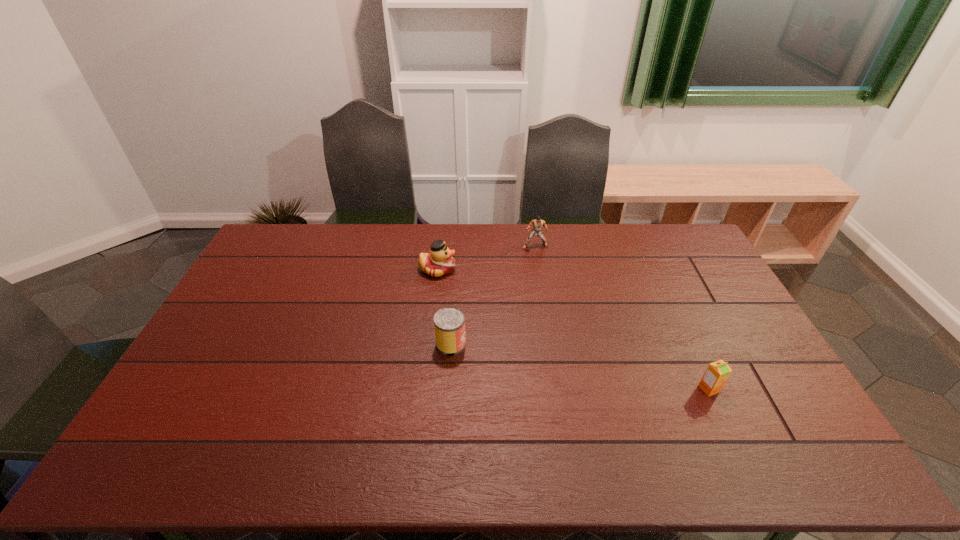
Image resolution: width=960 pixels, height=540 pixels. I want to click on puncher, so click(537, 224).

This screenshot has width=960, height=540. I want to click on the second object from right to left, so click(537, 224).

The image size is (960, 540). What are the coordinates of `the third nearest object` in the screenshot? It's located at (439, 262).

Where is `can`? This screenshot has width=960, height=540. can is located at coordinates (449, 322).

Identify the location of orange juice. The width and height of the screenshot is (960, 540). (717, 373).

Where is `the nearest object`? This screenshot has height=540, width=960. the nearest object is located at coordinates (717, 373).

Find the location of a particular element. This screenshot has height=540, width=960. free space located on the front-facing side of the second object from right to left is located at coordinates (543, 300).

Locate an element on the screen. The image size is (960, 540). vacant region located 0.390m on the face of the third nearest object is located at coordinates [x=564, y=269].

You are a GUI agent. You are given a task and a screenshot of the screen. Output one action in this format:
    pyautogui.click(x=<x>, y=<y>)
    Task: Click on the vacant space located 0.370m on the back of the can
    The height and width of the screenshot is (540, 960).
    Given the screenshot: What is the action you would take?
    pyautogui.click(x=457, y=258)

Locate an element on the screen. vacant point located on the back of the nearest object is located at coordinates (669, 303).